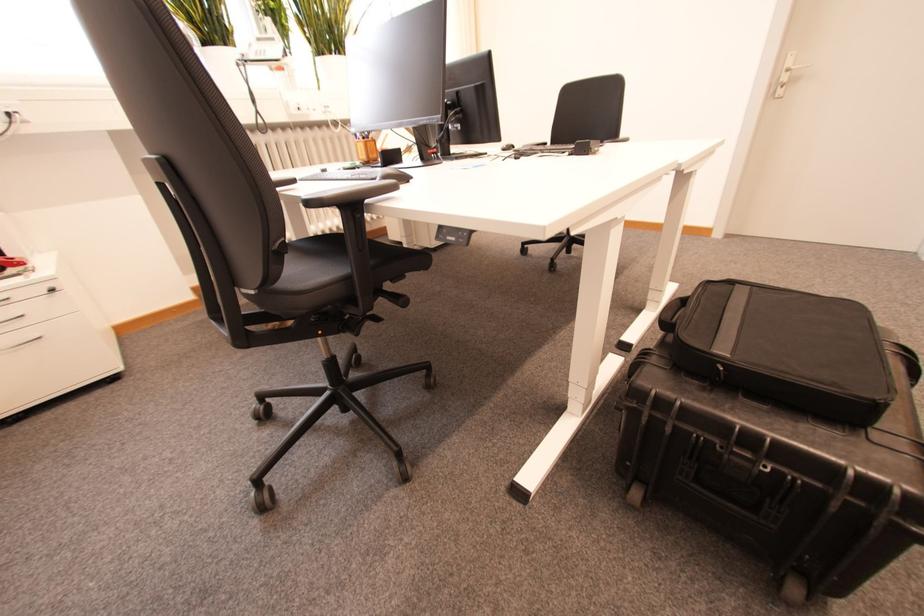
Find where to press the desk height control. Please return your answer as a coordinate pair (x, y).

(453, 235)